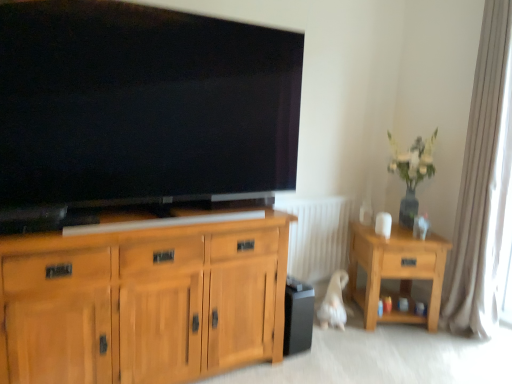
Describe the element at coordinates (140, 111) in the screenshot. I see `black glossy tv at upper center` at that location.

The image size is (512, 384). What do you see at coordinates (483, 183) in the screenshot?
I see `white fabric curtain at right` at bounding box center [483, 183].

What do you see at coordinates (317, 235) in the screenshot? I see `white plastic radiator at center` at bounding box center [317, 235].

What is the approximate height of light wood cabinet at left?

light wood cabinet at left is 82.38 centimeters in height.

Where is `light oak wooden side table at right`? The image size is (512, 384). light oak wooden side table at right is located at coordinates pyautogui.click(x=396, y=271).

Is white fabric curtain at right taller or shorter than green glossy vase at upper right?

Clearly, white fabric curtain at right is taller compared to green glossy vase at upper right.

Does white fabric curtain at right have a lesser width compared to green glossy vase at upper right?

Yes, white fabric curtain at right is thinner than green glossy vase at upper right.

Which object is closer to the camera, white fabric curtain at right or green glossy vase at upper right?

Positioned in front is white fabric curtain at right.

Considering the relative positions of white fabric curtain at right and green glossy vase at upper right in the image provided, is white fabric curtain at right to the left of green glossy vase at upper right from the viewer's perspective?

No.

How many degrees apart are the facing directions of green glossy vase at upper right and black matte speaker at lower center?

The angle between the facing direction of green glossy vase at upper right and the facing direction of black matte speaker at lower center is 36.3 degrees.

Considering the relative sizes of green glossy vase at upper right and black matte speaker at lower center in the image provided, is green glossy vase at upper right shorter than black matte speaker at lower center?

No, green glossy vase at upper right is not shorter than black matte speaker at lower center.

Between green glossy vase at upper right and black matte speaker at lower center, which one appears on the left side from the viewer's perspective?

black matte speaker at lower center.

Is point (403, 171) in front of point (312, 300)?

No, it is not.

Identify the location of desk below the white fabric curtain at right (from a real-world perspective). (396, 271).

From a real-world perspective, is light oak wooden side table at right on top of white fabric curtain at right?

No, from a real-world perspective, light oak wooden side table at right is not over white fabric curtain at right

Is light oak wooden side table at right in front of or behind white fabric curtain at right in the image?

Visually, light oak wooden side table at right is located behind white fabric curtain at right.

Locate an element on the screen. curtain behind the black glossy tv at upper center is located at coordinates (483, 183).

Is black glossy tv at upper center positioned with its back to white fabric curtain at right?

black glossy tv at upper center does not have its back to white fabric curtain at right.

How many degrees apart are the facing directions of black glossy tv at upper center and white fabric curtain at right?

black glossy tv at upper center and white fabric curtain at right are facing 87.4 degrees away from each other.

Is black glossy tv at upper center at the right side of white fabric curtain at right?

No, black glossy tv at upper center is not to the right of white fabric curtain at right.

Does black glossy tv at upper center have a greater height compared to white plastic radiator at center?

Correct, black glossy tv at upper center is much taller as white plastic radiator at center.

Locate an element on the screen. radiator located below the black glossy tv at upper center (from the image's perspective) is located at coordinates (317, 235).

Is black glossy tv at upper center bigger or smaller than white plastic radiator at center?

Clearly, black glossy tv at upper center is larger in size than white plastic radiator at center.

Between point (245, 63) and point (335, 264), which one is positioned behind?

The point (335, 264) is behind.

Which is behind, light wood cabinet at left or white fabric curtain at right?

white fabric curtain at right is behind.

From the picture: Is light wood cabinet at left not close to white fabric curtain at right?

Yes, light wood cabinet at left and white fabric curtain at right are quite far apart.

From a real-world perspective, is light wood cabinet at left beneath white fabric curtain at right?

Correct, in the physical world, light wood cabinet at left is lower than white fabric curtain at right.

Considering the points (114, 328) and (505, 165), which point is behind, point (114, 328) or point (505, 165)?

Point (505, 165)

Would you say white fabric curtain at right is inside or outside white plastic radiator at center?

The correct answer is: outside.

Are white fabric curtain at right and white plastic radiator at center located far from each other?

white fabric curtain at right is actually quite close to white plastic radiator at center.

In the image, is white fabric curtain at right positioned in front of or behind white plastic radiator at center?

Clearly, white fabric curtain at right is in front of white plastic radiator at center.

In the image, there is a white fabric curtain at right. Identify the location of houseplant below it (from a real-world perspective). This screenshot has height=384, width=512. (412, 172).

Identify the location of loudspeaker in front of the green glossy vase at upper right. (298, 316).

Estimate the real-world distances between objects in this image. Which object is closer to black matte speaker at lower center, light oak wooden side table at right or black glossy tv at upper center?

light oak wooden side table at right lies closer to black matte speaker at lower center than the other object.

Which object lies further to the anchor point light oak wooden side table at right, white plastic radiator at center or green glossy vase at upper right?

Among the two, green glossy vase at upper right is located further to light oak wooden side table at right.

Estimate the real-world distances between objects in this image. Which object is further from light wood cabinet at left, light oak wooden side table at right or white plastic radiator at center?

light oak wooden side table at right.

Which object lies nearer to the anchor point green glossy vase at upper right, light oak wooden side table at right or black glossy tv at upper center?

Based on the image, light oak wooden side table at right appears to be nearer to green glossy vase at upper right.

When comparing their distances from light oak wooden side table at right, does black glossy tv at upper center or green glossy vase at upper right seem further?

black glossy tv at upper center lies further to light oak wooden side table at right than the other object.

From the picture: Looking at the image, which one is located closer to light wood cabinet at left, white plastic radiator at center or light oak wooden side table at right?

Based on the image, white plastic radiator at center appears to be nearer to light wood cabinet at left.

Which object lies further to the anchor point white plastic radiator at center, black matte speaker at lower center or light wood cabinet at left?

light wood cabinet at left lies further to white plastic radiator at center than the other object.

Which object lies nearer to the anchor point light wood cabinet at left, green glossy vase at upper right or black matte speaker at lower center?

black matte speaker at lower center is closer to light wood cabinet at left.

Where is `television situated between light wood cabinet at left and green glossy vase at upper right from left to right`? television situated between light wood cabinet at left and green glossy vase at upper right from left to right is located at coordinates (140, 111).

Where is `houseplant between light wood cabinet at left and white fabric curtain at right from left to right`? The width and height of the screenshot is (512, 384). houseplant between light wood cabinet at left and white fabric curtain at right from left to right is located at coordinates (412, 172).

Locate an element on the screen. The width and height of the screenshot is (512, 384). loudspeaker situated between light wood cabinet at left and green glossy vase at upper right from left to right is located at coordinates (298, 316).

You are a GUI agent. You are given a task and a screenshot of the screen. Output one action in this format:
    pyautogui.click(x=<x>, y=<y>)
    Task: Click on the television situated between light wood cabinet at left and white fabric curtain at right from left to right
    The width and height of the screenshot is (512, 384).
    Given the screenshot: What is the action you would take?
    pyautogui.click(x=140, y=111)